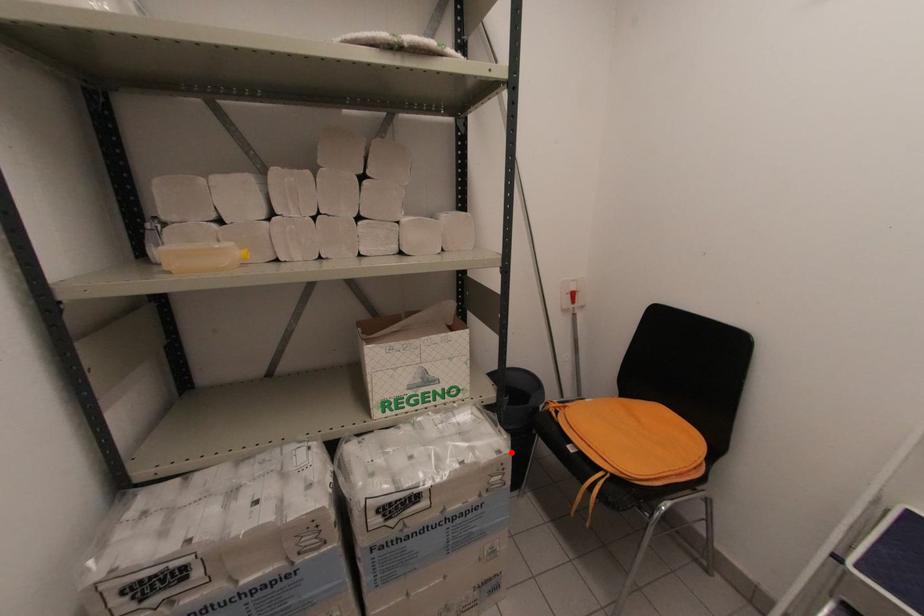
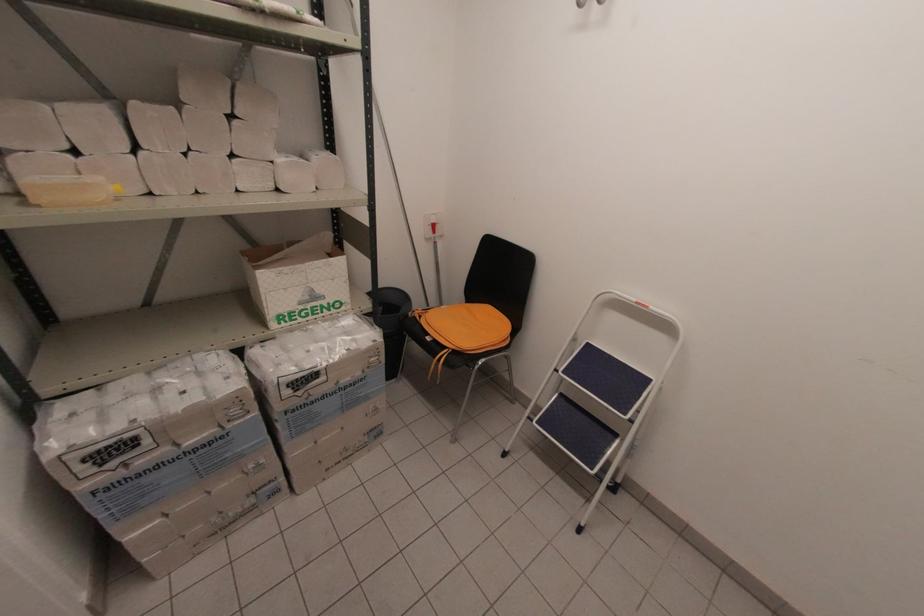
Where in the second image is the point corresponding to the highlighted location from the first image?

(383, 341)